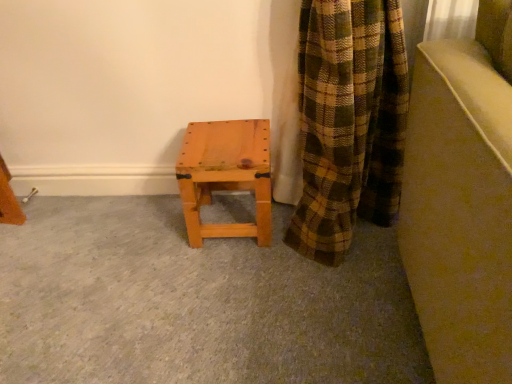
Find the location of a particular element. vacant space situated on the left part of natural wood stool at center is located at coordinates (152, 227).